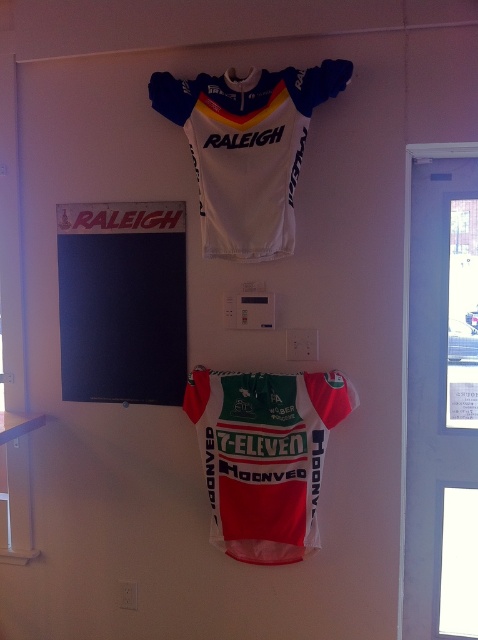
You are an art curator planning to install a new exhibition. You have a black matte poster at upper center and a white matte jersey at upper center. Which object should you consider moving if you want to free up space for a larger sculpture? Explain your reasoning.

→ The black matte poster at upper center is smaller than the white matte jersey at upper center. Since the poster takes up less space, you should consider moving it to free up more space for the larger sculpture.